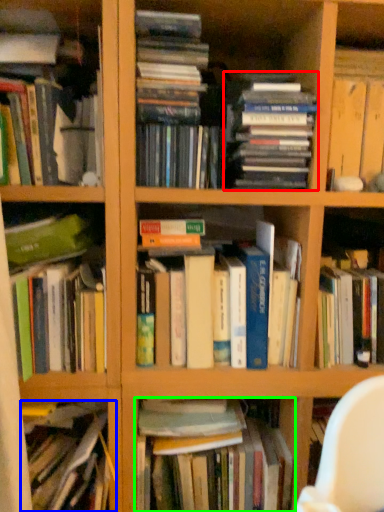
Question: Considering the real-world distances, which object is closest to book (highlighted by a red box)? book (highlighted by a blue box) or book (highlighted by a green box).

Choices:
 (A) book
 (B) book

Answer: (B)